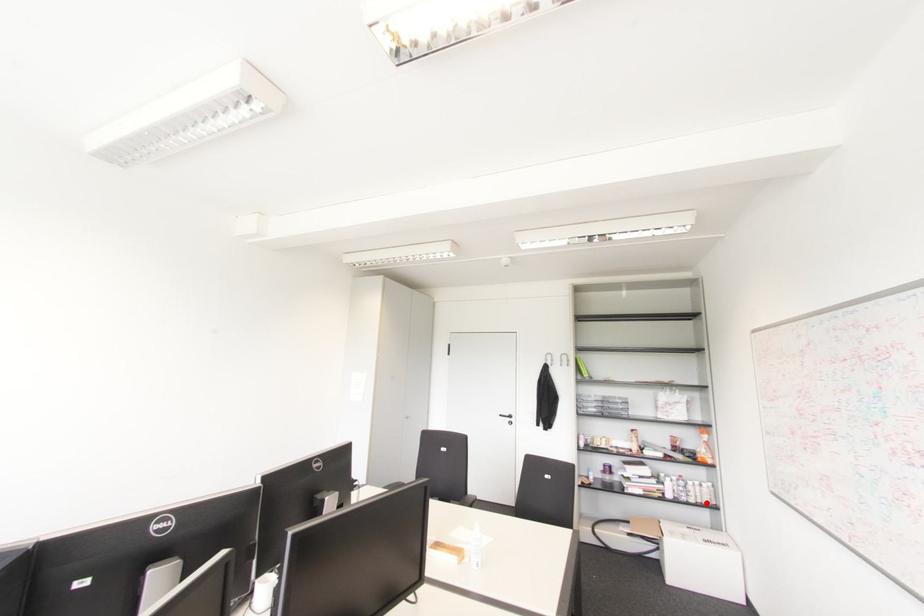
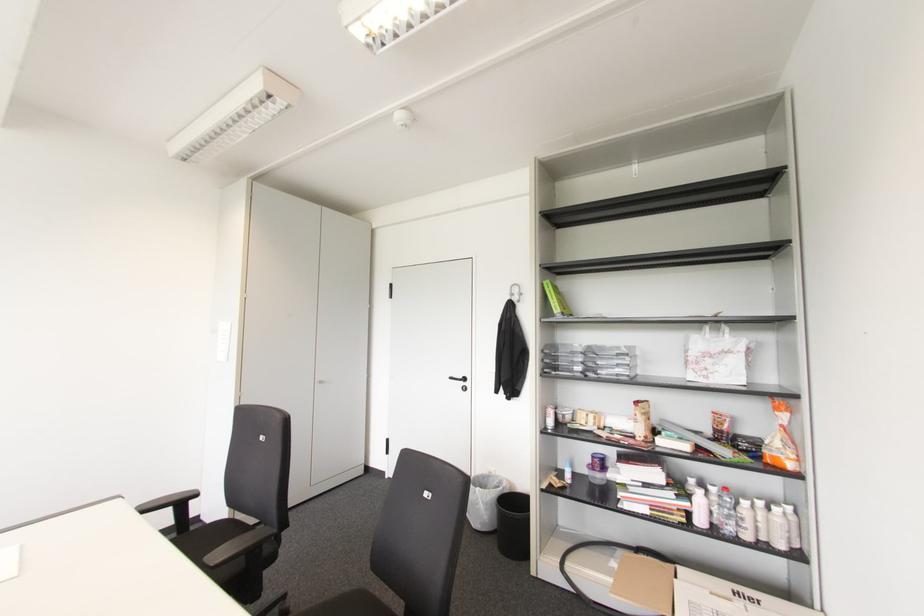
In the second image, find the point that corresponds to the highlighted location in the first image.

(781, 546)